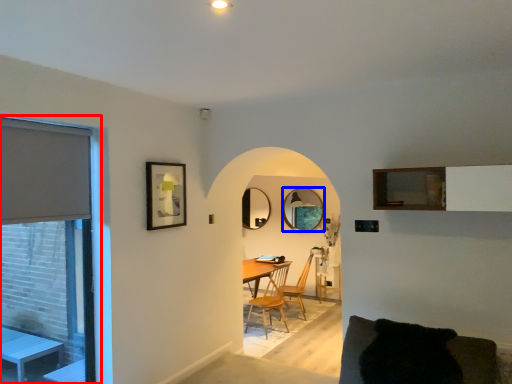
Question: Among these objects, which one is farthest to the camera, window (highlighted by a red box) or mirror (highlighted by a blue box)?

Choices:
 (A) window
 (B) mirror

Answer: (B)